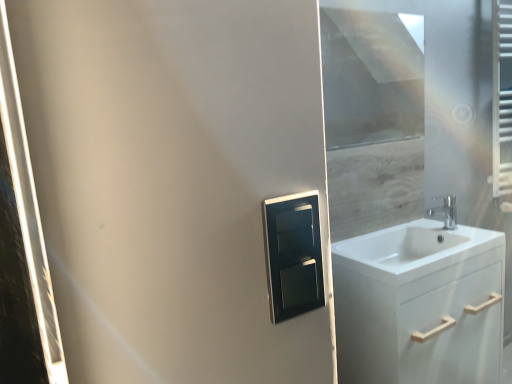
Question: Would you say transparent glass window screen at upper right is outside white glossy sink at right?

Choices:
 (A) no
 (B) yes

Answer: (B)

Question: Can you confirm if transparent glass window screen at upper right is shorter than white glossy sink at right?

Choices:
 (A) no
 (B) yes

Answer: (A)

Question: From the image's perspective, is transparent glass window screen at upper right on white glossy sink at right?

Choices:
 (A) yes
 (B) no

Answer: (A)

Question: Does transparent glass window screen at upper right have a greater width compared to white glossy sink at right?

Choices:
 (A) no
 (B) yes

Answer: (A)

Question: Is transparent glass window screen at upper right closer to camera compared to white glossy sink at right?

Choices:
 (A) no
 (B) yes

Answer: (A)

Question: From a real-world perspective, is transparent glass window screen at upper right on top of white glossy sink at right?

Choices:
 (A) yes
 (B) no

Answer: (A)

Question: Is chrome metallic faucet at right at the left side of transparent glass window screen at upper right?

Choices:
 (A) yes
 (B) no

Answer: (B)

Question: From the image's perspective, would you say chrome metallic faucet at right is positioned over transparent glass window screen at upper right?

Choices:
 (A) yes
 (B) no

Answer: (B)

Question: From a real-world perspective, is chrome metallic faucet at right physically above transparent glass window screen at upper right?

Choices:
 (A) yes
 (B) no

Answer: (B)

Question: Are chrome metallic faucet at right and transparent glass window screen at upper right beside each other?

Choices:
 (A) no
 (B) yes

Answer: (A)

Question: Is chrome metallic faucet at right closer to the viewer compared to transparent glass window screen at upper right?

Choices:
 (A) no
 (B) yes

Answer: (A)

Question: Is chrome metallic faucet at right facing away from transparent glass window screen at upper right?

Choices:
 (A) yes
 (B) no

Answer: (B)

Question: Does white glossy sink at right turn towards chrome metallic faucet at right?

Choices:
 (A) no
 (B) yes

Answer: (A)